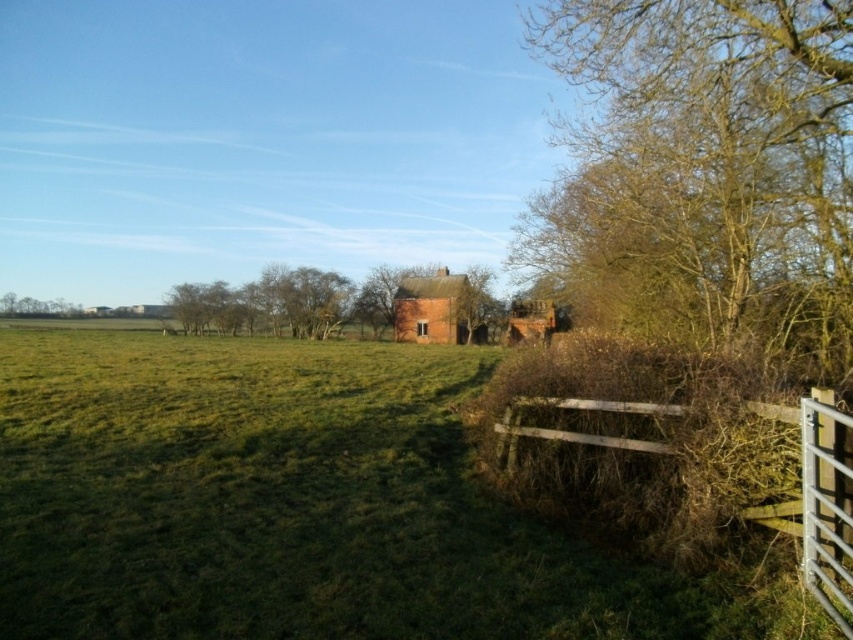
Question: Which of these objects is positioned farthest from the brick house at center?

Choices:
 (A) wooden gate at lower right
 (B) green leafy tree at left
 (C) green grassy at center

Answer: (A)

Question: Can you confirm if brick house at center is positioned below green leafy tree at left?

Choices:
 (A) no
 (B) yes

Answer: (B)

Question: Based on their relative distances, which object is nearer to the green grassy at center?

Choices:
 (A) green leafy tree at left
 (B) brown leafless tree at upper right

Answer: (B)

Question: Is green grassy at center smaller than wooden gate at lower right?

Choices:
 (A) no
 (B) yes

Answer: (A)

Question: Among these points, which one is farthest from the camera?

Choices:
 (A) tap(810, 170)
 (B) tap(450, 316)

Answer: (B)

Question: Does green grassy at center come behind green leafy tree at left?

Choices:
 (A) no
 (B) yes

Answer: (A)